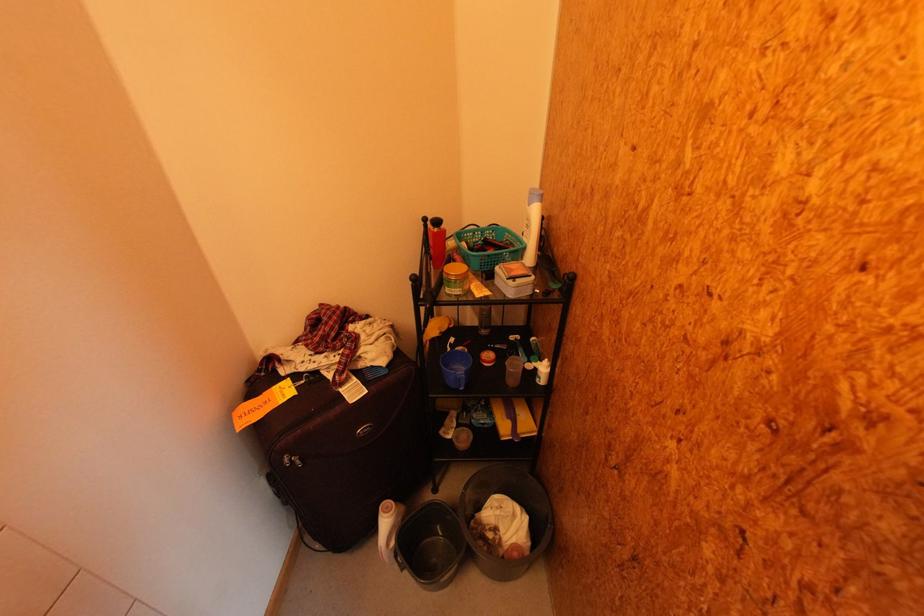
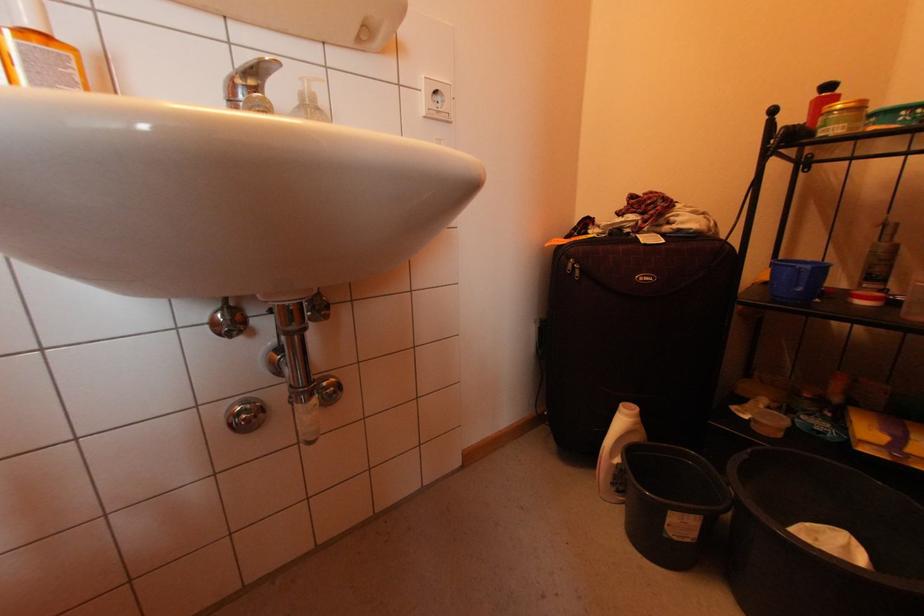
Locate, in the second image, the point that corresponds to point (296, 460) in the first image.

(578, 265)